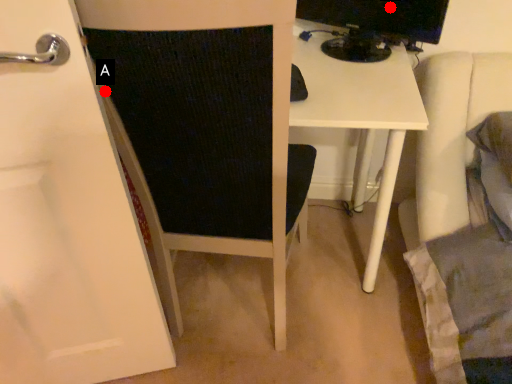
Question: Two points are circled on the image, labeled by A and B beside each circle. Which point is farther to the camera?

Choices:
 (A) A is further
 (B) B is further

Answer: (B)